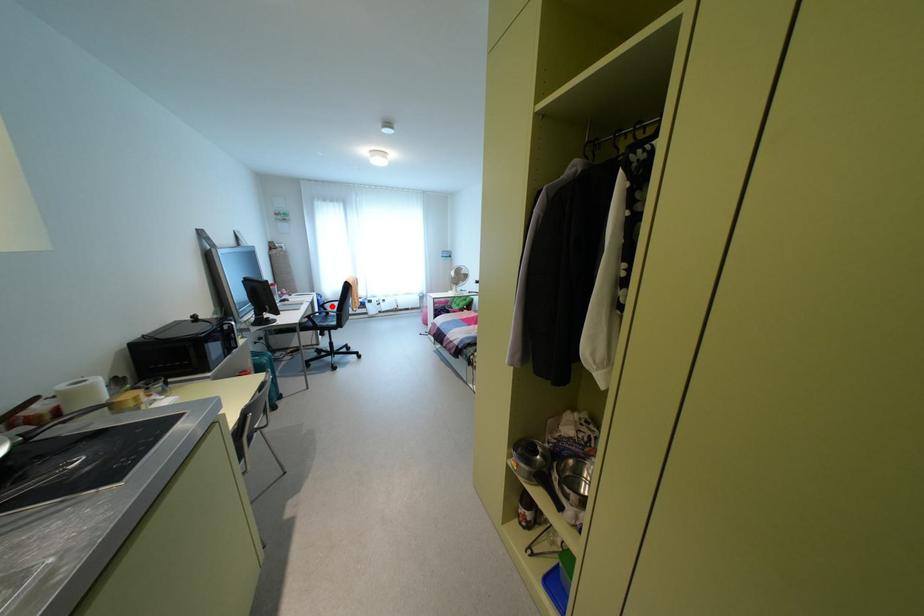
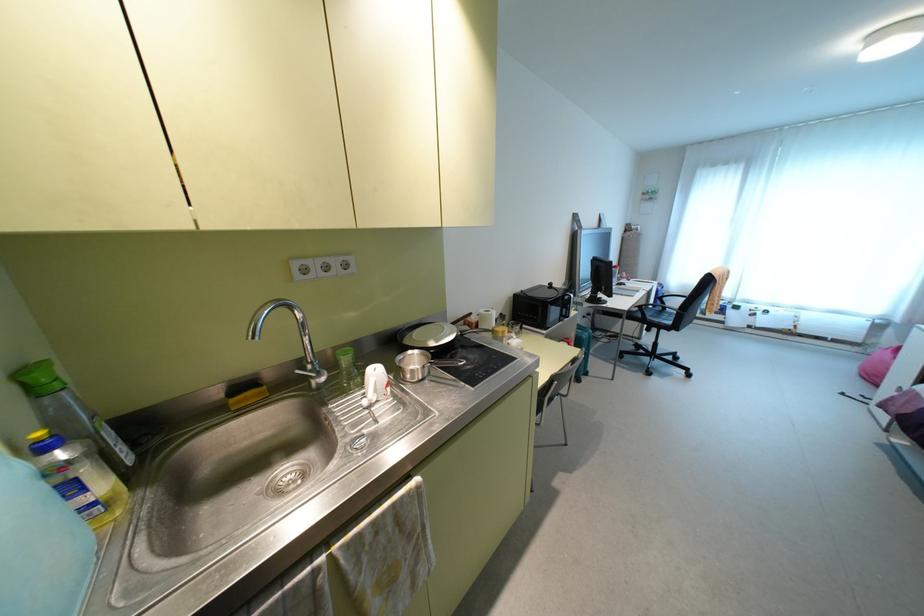
The point at the highlighted location is marked in the first image. Where is the corresponding point in the second image?

(674, 302)